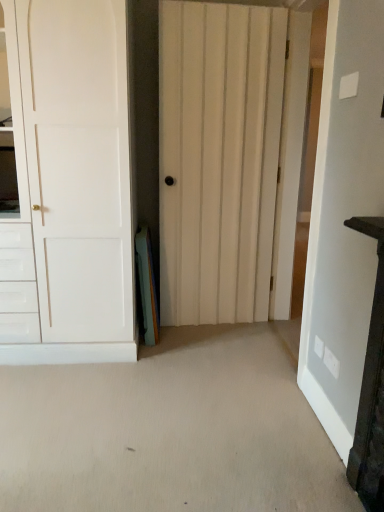
Question: Should I look upward or downward to see white wood door at center, which is the second door from right to left?

Choices:
 (A) down
 (B) up

Answer: (B)

Question: Is white wood door at center, which is the second door from right to left, oriented away from dark wood vanity at right?

Choices:
 (A) yes
 (B) no

Answer: (B)

Question: From a real-world perspective, is white wood door at center, which is the second door from right to left, positioned under dark wood vanity at right based on gravity?

Choices:
 (A) yes
 (B) no

Answer: (B)

Question: Is white wood door at center, positioned as the second door in left-to-right order, thinner than dark wood vanity at right?

Choices:
 (A) yes
 (B) no

Answer: (A)

Question: Does white wood door at center, positioned as the second door in left-to-right order, have a greater height compared to dark wood vanity at right?

Choices:
 (A) yes
 (B) no

Answer: (A)

Question: Is white wood door at center, positioned as the second door in left-to-right order, shorter than dark wood vanity at right?

Choices:
 (A) yes
 (B) no

Answer: (B)

Question: Considering the relative sizes of white wood door at center, positioned as the second door in left-to-right order, and dark wood vanity at right in the image provided, is white wood door at center, positioned as the second door in left-to-right order, bigger than dark wood vanity at right?

Choices:
 (A) yes
 (B) no

Answer: (A)

Question: Could you tell me if white wooden door at center, the first door in the right-to-left sequence, is facing white matte door at left, the 1th door in the left-to-right sequence?

Choices:
 (A) no
 (B) yes

Answer: (B)

Question: Is white wooden door at center, the first door in the right-to-left sequence, closer to the viewer compared to white matte door at left, the 1th door in the left-to-right sequence?

Choices:
 (A) no
 (B) yes

Answer: (B)

Question: Can you confirm if white wooden door at center, marked as the third door in a left-to-right arrangement, is positioned to the right of white matte door at left, the 1th door in the left-to-right sequence?

Choices:
 (A) no
 (B) yes

Answer: (B)

Question: Is white wooden door at center, the first door in the right-to-left sequence, outside white matte door at left, the 3th door viewed from the right?

Choices:
 (A) no
 (B) yes

Answer: (B)

Question: Can you confirm if white wooden door at center, marked as the third door in a left-to-right arrangement, is taller than white matte door at left, the 3th door viewed from the right?

Choices:
 (A) yes
 (B) no

Answer: (A)

Question: Would you consider white wooden door at center, the first door in the right-to-left sequence, to be distant from white matte door at left, the 3th door viewed from the right?

Choices:
 (A) no
 (B) yes

Answer: (B)

Question: Does white wooden door at center, the first door in the right-to-left sequence, lie behind dark wood vanity at right?

Choices:
 (A) yes
 (B) no

Answer: (A)